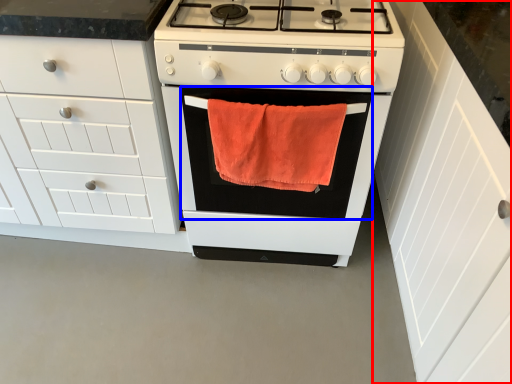
Question: Which object is further to the camera taking this photo, cabinetry (highlighted by a red box) or oven (highlighted by a blue box)?

Choices:
 (A) cabinetry
 (B) oven

Answer: (B)